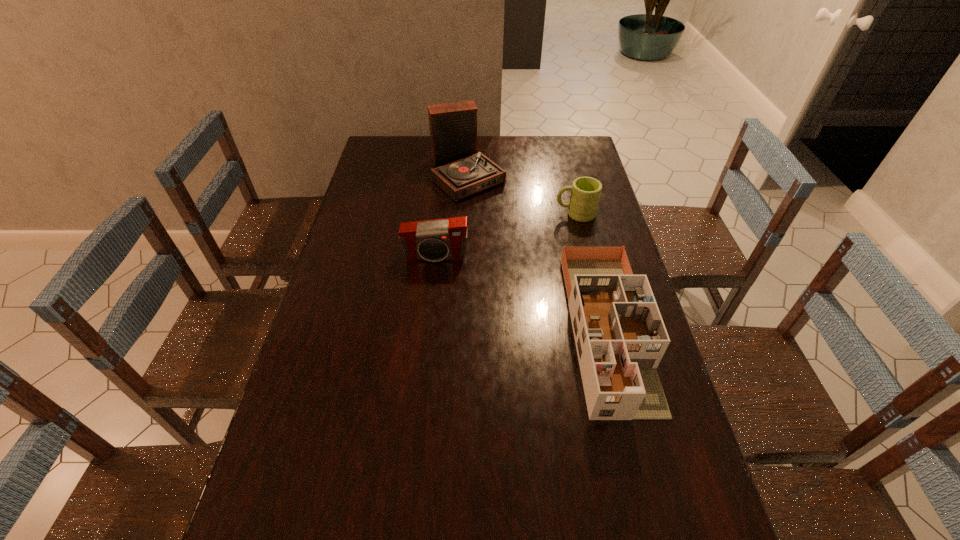
Identify the location of vacant space located 0.080m at the front door of the dollhouse. (639, 455).

Where is `object situated at the far edge`? The height and width of the screenshot is (540, 960). object situated at the far edge is located at coordinates (460, 171).

The height and width of the screenshot is (540, 960). I want to click on mug located in the right edge section of the desktop, so click(585, 194).

The width and height of the screenshot is (960, 540). Find the location of `dollhouse located in the right edge section of the desktop`. dollhouse located in the right edge section of the desktop is located at coordinates (620, 336).

Where is `vacant space at the far edge of the desktop`? This screenshot has height=540, width=960. vacant space at the far edge of the desktop is located at coordinates (421, 144).

The height and width of the screenshot is (540, 960). In order to click on free space at the left edge of the desktop in this screenshot , I will do `click(376, 254)`.

The width and height of the screenshot is (960, 540). I want to click on vacant area at the right edge, so click(x=663, y=497).

At what (x,y) coordinates should I click in order to perform the action: click on free space at the far left corner of the desktop. Please return your answer as a coordinate pair (x, y). Looking at the image, I should click on [407, 141].

Locate an element on the screen. This screenshot has height=540, width=960. empty space between the second farthest object and the phonograph record is located at coordinates (521, 194).

Where is `free spot between the second farthest object and the phonograph record`? free spot between the second farthest object and the phonograph record is located at coordinates (521, 194).